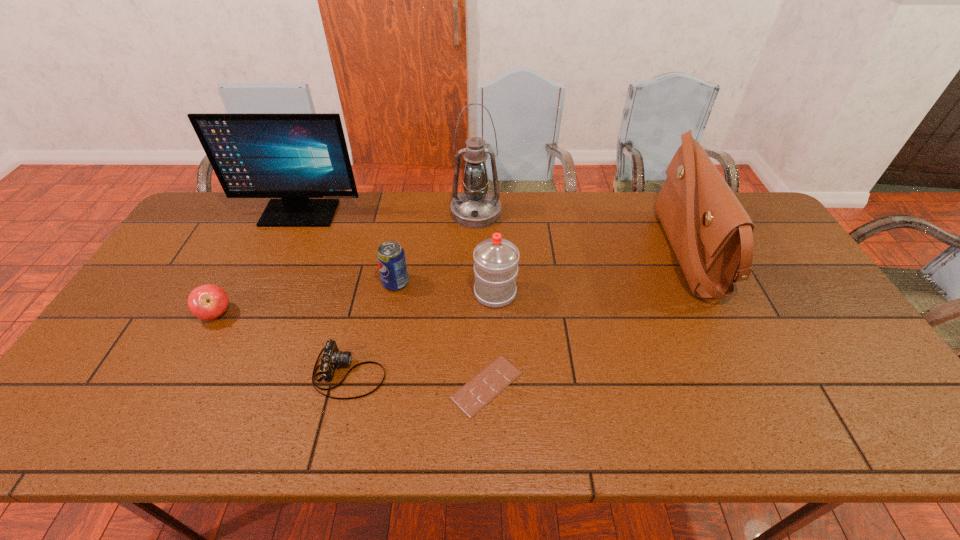
This screenshot has height=540, width=960. What are the coordinates of `oil lamp` in the screenshot? It's located at (475, 207).

Identify the location of monitor. Image resolution: width=960 pixels, height=540 pixels. (294, 157).

I want to click on the third tallest object, so click(711, 234).

Identify the location of satchel. This screenshot has height=540, width=960. (711, 234).

The height and width of the screenshot is (540, 960). In order to click on water bottle in this screenshot , I will do `click(496, 259)`.

Locate an element on the screen. This screenshot has height=540, width=960. the fourth shortest object is located at coordinates (391, 258).

In order to click on apple in this screenshot , I will do click(x=208, y=301).

Where is `the seventh tallest object`? The image size is (960, 540). the seventh tallest object is located at coordinates (331, 358).

Identify the location of the shortest object. The height and width of the screenshot is (540, 960). (486, 385).

You are a GUI agent. You are given a task and a screenshot of the screen. Output one action in this format:
    pyautogui.click(x=<x>, y=<y>)
    Task: Click on the vacant area located on the right of the oil lamp
    
    Given the screenshot: What is the action you would take?
    pyautogui.click(x=537, y=212)